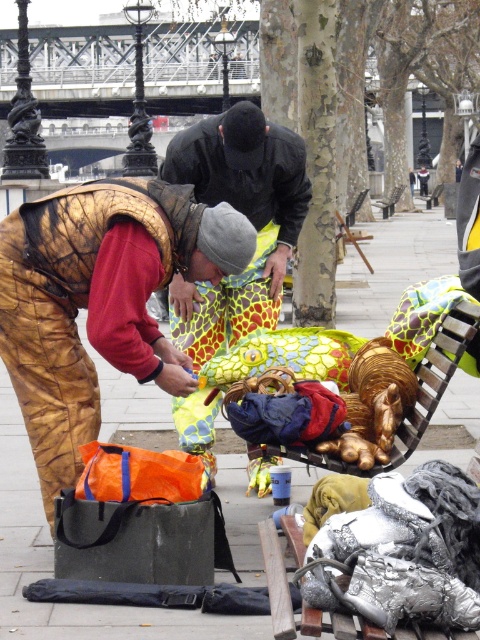
Does orange fabric bag at lower left appear on the right side of camouflage fabric man at center?

Yes, orange fabric bag at lower left is to the right of camouflage fabric man at center.

How much distance is there between orange fabric bag at lower left and camouflage fabric man at center?

They are 8.59 meters apart.

Where is `orange fabric bag at lower left`? This screenshot has height=640, width=480. orange fabric bag at lower left is located at coordinates (51, 564).

Does camouflage fabric street artist at left appear over orange fabric bag at lower left?

No, camouflage fabric street artist at left is not above orange fabric bag at lower left.

Is camouflage fabric street artist at left in front of orange fabric bag at lower left?

No, it is not.

Measure the distance between point (61, 384) and camera.

27.92 feet

You are a GUI agent. You are given a task and a screenshot of the screen. Output one action in this format:
    pyautogui.click(x=<x>, y=<y>)
    Task: Click on the camouflage fabric street artist at left
    This screenshot has width=480, height=640.
    Given the screenshot: What is the action you would take?
    pyautogui.click(x=99, y=301)

Which is in front, point (180, 438) or point (375, 204)?

Positioned in front is point (180, 438).

Is point (291, 225) positioned behind point (388, 202)?

No, (291, 225) is closer to viewer.

Is point (176, 170) farther from viewer compared to point (398, 198)?

No, it is not.

Identify the location of camouflage fabric man at center. The height and width of the screenshot is (640, 480). tap(247, 218).